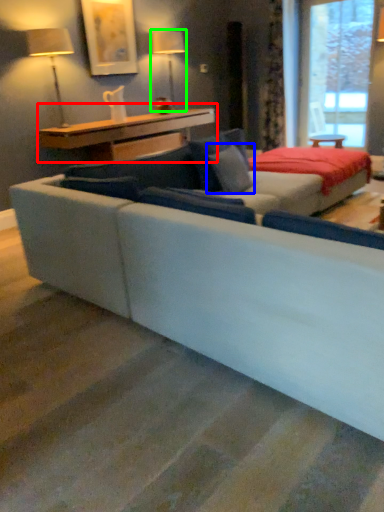
Question: Based on their relative distances, which object is nearer to table (highlighted by a red box)? Choose from pillow (highlighted by a blue box) and table lamp (highlighted by a green box).

Choices:
 (A) pillow
 (B) table lamp

Answer: (B)